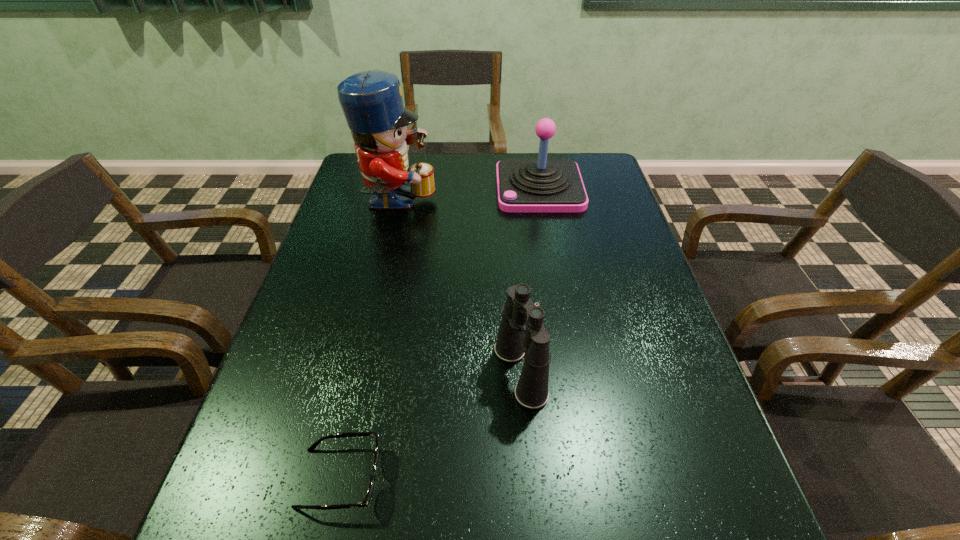
The height and width of the screenshot is (540, 960). Find the location of `vacant space located on the lenses of the spectacles`. vacant space located on the lenses of the spectacles is located at coordinates (612, 477).

Locate an element on the screen. nutcracker situated at the far edge is located at coordinates (372, 103).

At what (x,y) coordinates should I click in order to perform the action: click on joystick situated at the far edge. Please return your answer as a coordinate pair (x, y). Looking at the image, I should click on (542, 185).

The image size is (960, 540). I want to click on nutcracker at the left edge, so click(x=372, y=103).

Identify the location of spectacles located at the left edge. (365, 503).

Image resolution: width=960 pixels, height=540 pixels. I want to click on object that is at the right edge, so click(x=542, y=185).

Where is `object that is at the far left corner`? object that is at the far left corner is located at coordinates (372, 103).

Where is `object located at the far right corner`? The image size is (960, 540). object located at the far right corner is located at coordinates (542, 185).

This screenshot has width=960, height=540. I want to click on free region at the far edge of the desktop, so click(x=535, y=158).

Where is `vacant space at the near edge`? vacant space at the near edge is located at coordinates (529, 521).